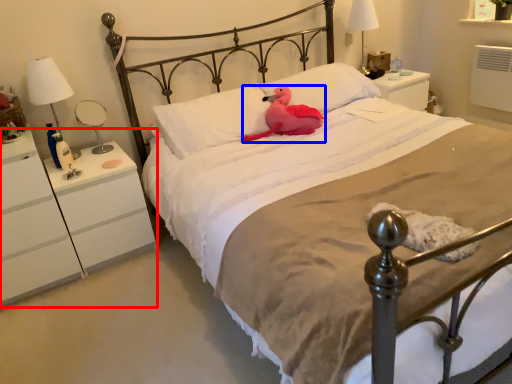
Question: Which object is further to the camera taking this photo, nightstand (highlighted by a red box) or animal (highlighted by a blue box)?

Choices:
 (A) nightstand
 (B) animal

Answer: (B)